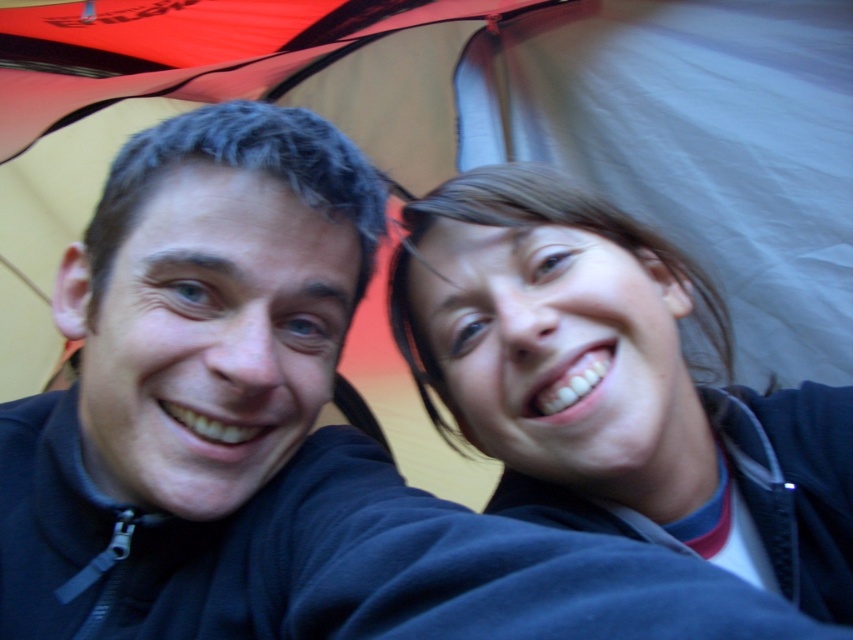
Question: Does black matte jacket at left have a lesser width compared to smooth skin face at upper right?

Choices:
 (A) no
 (B) yes

Answer: (B)

Question: Does black matte jacket at left appear under smooth skin face at upper right?

Choices:
 (A) no
 (B) yes

Answer: (A)

Question: Which point is farther to the camera?

Choices:
 (A) black matte jacket at left
 (B) smooth skin face at upper right

Answer: (B)

Question: Among these points, which one is farthest from the camera?

Choices:
 (A) (123, 509)
 (B) (531, 358)

Answer: (A)

Question: Can you confirm if black matte jacket at left is thinner than smooth skin face at upper right?

Choices:
 (A) yes
 (B) no

Answer: (A)